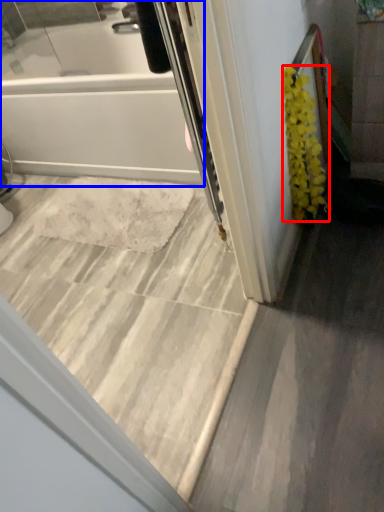
Question: Which of the following is the closest to the observer, flower (highlighted by a red box) or bathtub (highlighted by a blue box)?

Choices:
 (A) flower
 (B) bathtub

Answer: (B)